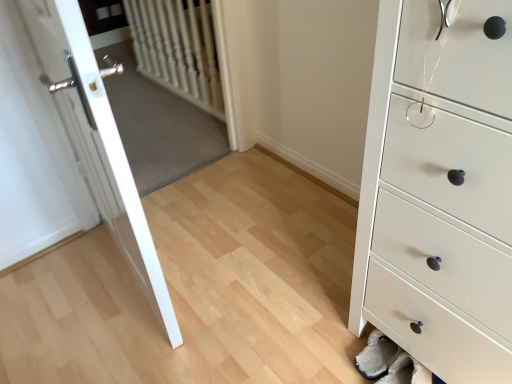
Question: Is white glossy door at left completely or partially outside of white matte chest of drawers at lower right?

Choices:
 (A) no
 (B) yes

Answer: (B)

Question: Is white glossy door at left positioned far away from white matte chest of drawers at lower right?

Choices:
 (A) no
 (B) yes

Answer: (A)

Question: Can you confirm if white glossy door at left is positioned to the right of white matte chest of drawers at lower right?

Choices:
 (A) no
 (B) yes

Answer: (A)

Question: From a real-world perspective, is white glossy door at left physically below white matte chest of drawers at lower right?

Choices:
 (A) yes
 (B) no

Answer: (B)

Question: Does white glossy door at left appear on the left side of white matte chest of drawers at lower right?

Choices:
 (A) yes
 (B) no

Answer: (A)

Question: Can you confirm if white glossy door at left is taller than white matte chest of drawers at lower right?

Choices:
 (A) no
 (B) yes

Answer: (B)

Question: Is white textured radiator at upper left behind white glossy door at left?

Choices:
 (A) no
 (B) yes

Answer: (B)

Question: Can you confirm if white textured radiator at upper left is shorter than white glossy door at left?

Choices:
 (A) no
 (B) yes

Answer: (B)

Question: Is white textured radiator at upper left to the left of white glossy door at left from the viewer's perspective?

Choices:
 (A) yes
 (B) no

Answer: (B)

Question: Is white textured radiator at upper left smaller than white glossy door at left?

Choices:
 (A) yes
 (B) no

Answer: (A)

Question: Is white textured radiator at upper left wider than white glossy door at left?

Choices:
 (A) no
 (B) yes

Answer: (A)

Question: From the image's perspective, is white textured radiator at upper left on white glossy door at left?

Choices:
 (A) no
 (B) yes

Answer: (B)

Question: Is white glossy door at left at the left side of white textured radiator at upper left?

Choices:
 (A) yes
 (B) no

Answer: (A)